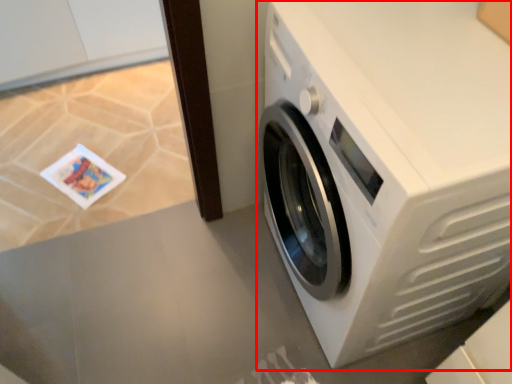
Question: Where is washing machine (annotated by the red box) located in relation to table top in the image?

Choices:
 (A) right
 (B) left

Answer: (A)